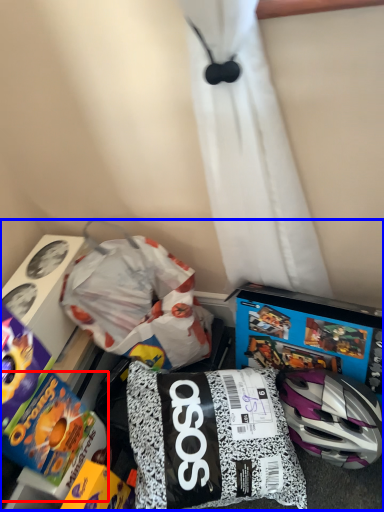
Question: Which of the following is the closest to the observer, toy (highlighted by a red box) or toy (highlighted by a blue box)?

Choices:
 (A) toy
 (B) toy

Answer: (B)